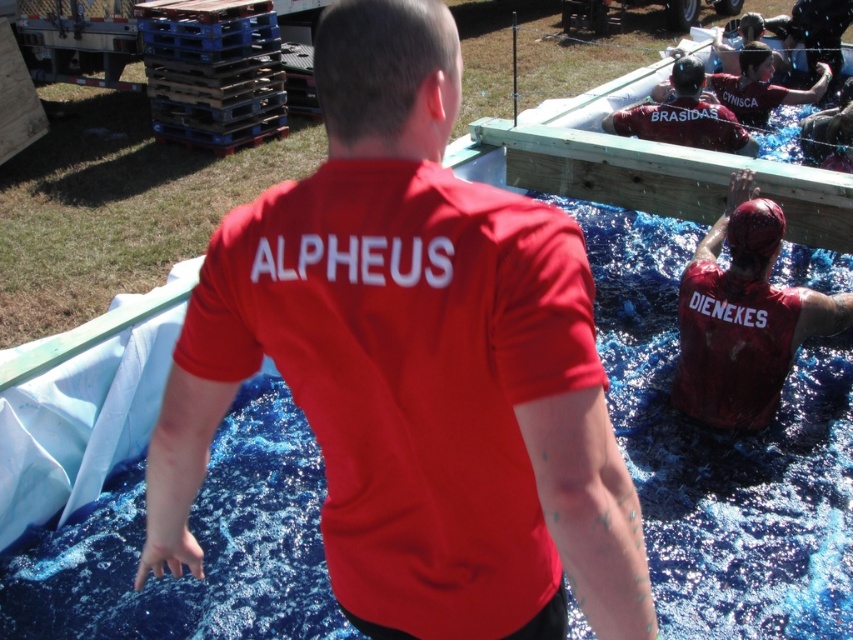
Is point (724, 212) farther from camera compared to point (753, 81)?

No, (724, 212) is in front of (753, 81).

Which is in front, point (744, 356) or point (729, 83)?

Positioned in front is point (744, 356).

The height and width of the screenshot is (640, 853). What do you see at coordinates (743, 316) in the screenshot?
I see `matte red shirt at right` at bounding box center [743, 316].

Where is `matte red shirt at right`? The height and width of the screenshot is (640, 853). matte red shirt at right is located at coordinates (743, 316).

Is matte red shirt at center above matte red shirt at upper right?

No, matte red shirt at center is not above matte red shirt at upper right.

Which of these two, matte red shirt at center or matte red shirt at upper right, stands shorter?

matte red shirt at upper right is shorter.

Between point (482, 218) and point (677, 83), which one is positioned in front?

Positioned in front is point (482, 218).

Find the location of `matte red shirt at center`. matte red shirt at center is located at coordinates (413, 365).

Between matte red shirt at center and matte red shirt at upper center, which one is positioned lower?

matte red shirt at center

Is matte red shirt at center above matte red shirt at upper center?

No, matte red shirt at center is not above matte red shirt at upper center.

Is point (346, 602) more distant than point (753, 154)?

No, it is in front of (753, 154).

The width and height of the screenshot is (853, 640). Identify the location of matte red shirt at center. (413, 365).